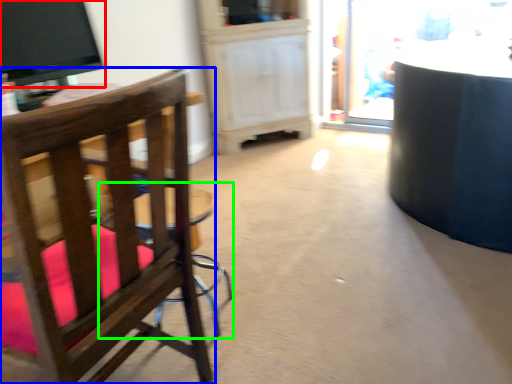
Question: Which object is positioned farthest from television (highlighted by a red box)? Select from chair (highlighted by a blue box) and bar stool (highlighted by a green box).

Choices:
 (A) chair
 (B) bar stool

Answer: (A)